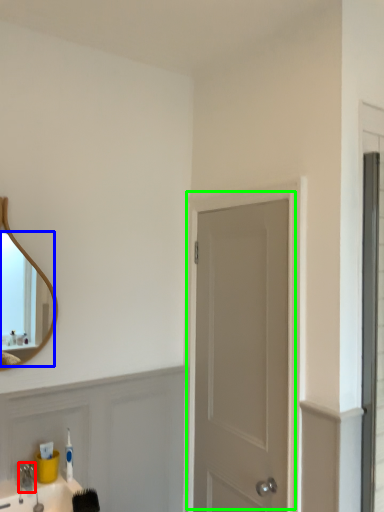
Question: Considering the real-world distances, which object is closest to faucet (highlighted by a red box)? mirror (highlighted by a blue box) or door (highlighted by a green box).

Choices:
 (A) mirror
 (B) door

Answer: (B)